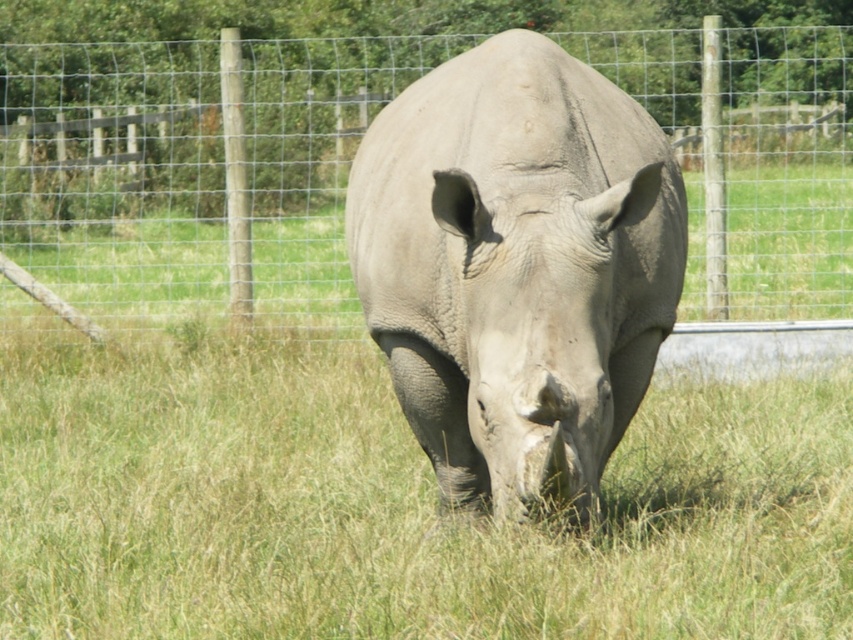
Is point (788, 236) less distant than point (395, 362)?

No, (788, 236) is further to viewer.

From the picture: Is wire mesh fence at center wider than gray matte rhinoceros at center?

Correct, the width of wire mesh fence at center exceeds that of gray matte rhinoceros at center.

Does point (231, 234) lie behind point (524, 196)?

Yes.

Where is `wire mesh fence at center`? The image size is (853, 640). wire mesh fence at center is located at coordinates (194, 170).